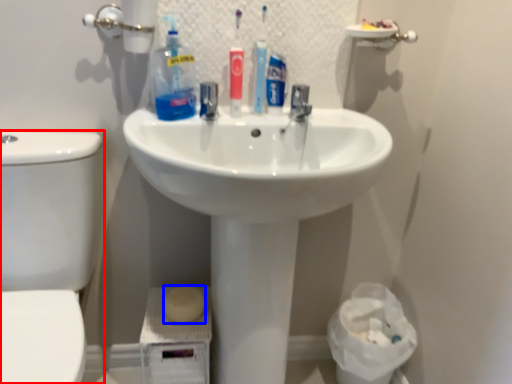
Question: Which of the following is the farthest to the observer, toilet bowl (highlighted by a red box) or soap (highlighted by a blue box)?

Choices:
 (A) toilet bowl
 (B) soap

Answer: (B)